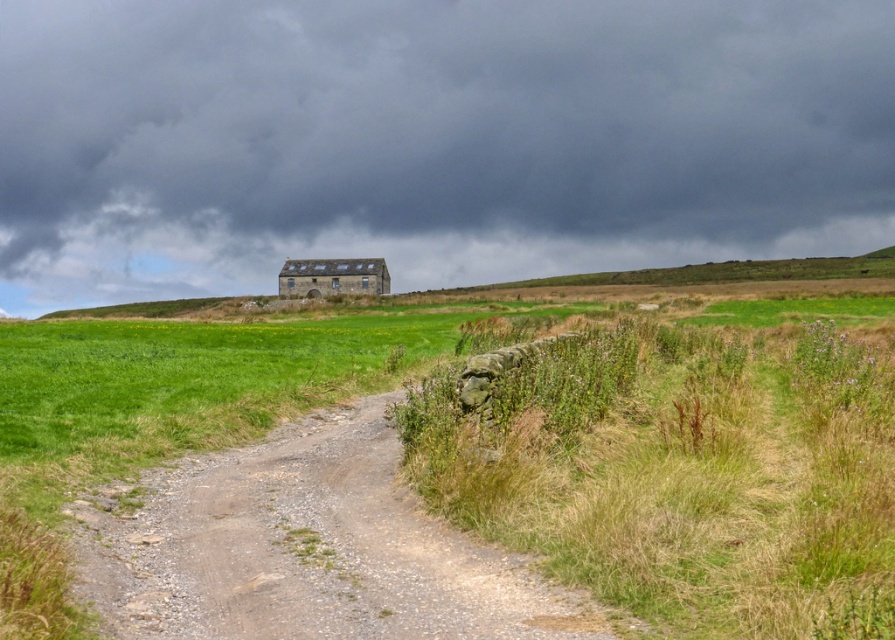
Question: Which object is farther from the camera taking this photo?

Choices:
 (A) dusty gravel path at center
 (B) dark gray stone wall at upper center

Answer: (B)

Question: Which object is closer to the camera taking this photo?

Choices:
 (A) dark gray stone wall at upper center
 (B) dusty gravel path at center

Answer: (B)

Question: Is dark gray stone wall at upper center smaller than dusty gravel path at center?

Choices:
 (A) no
 (B) yes

Answer: (A)

Question: From the image, what is the correct spatial relationship of dark gray stone wall at upper center in relation to dusty gravel path at center?

Choices:
 (A) above
 (B) below

Answer: (A)

Question: Does dark gray stone wall at upper center appear on the right side of dusty gravel path at center?

Choices:
 (A) no
 (B) yes

Answer: (A)